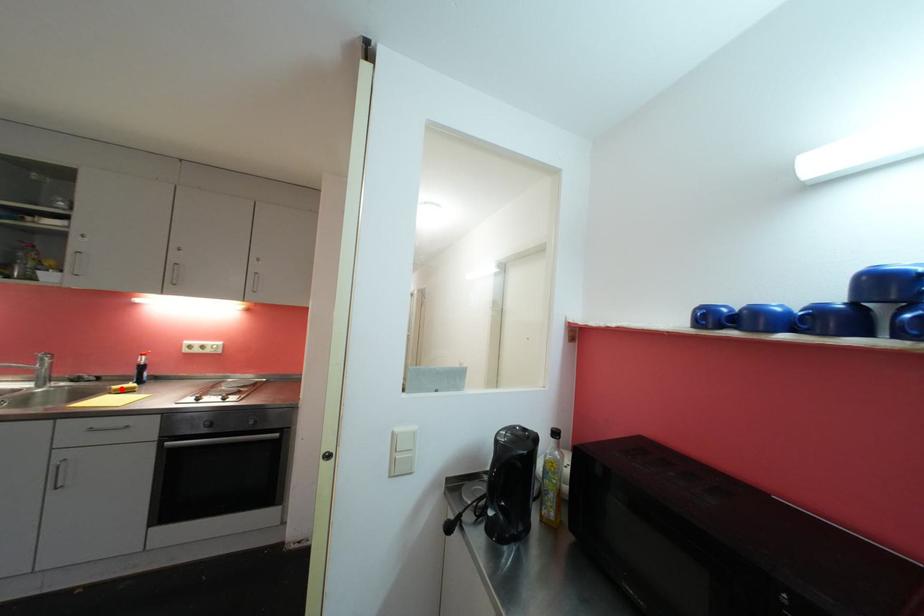
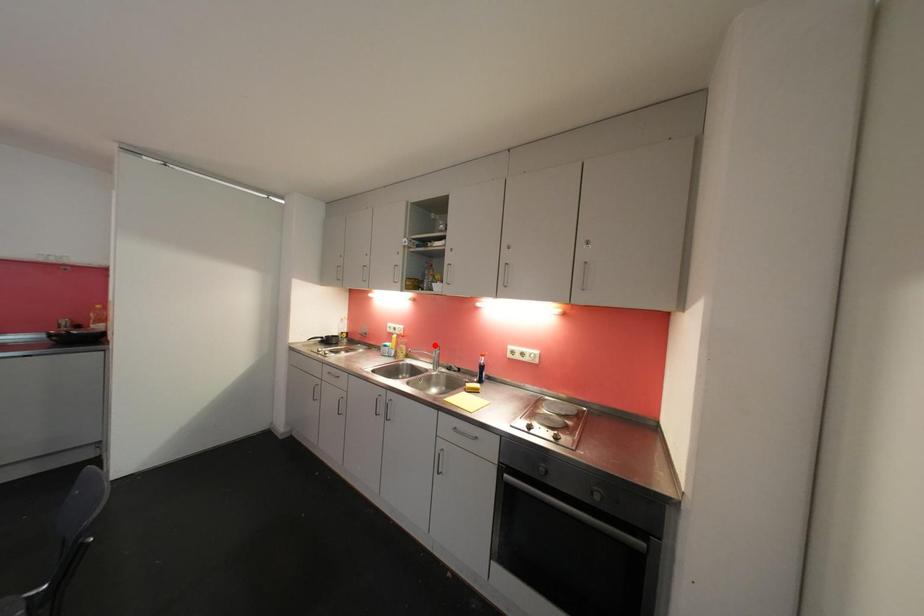
I am providing you with two images of the same scene from different viewpoints. A red point is marked on the first image and another point is marked on the second image. Are the points marked in image1 and image2 representing the same 3D position?

No